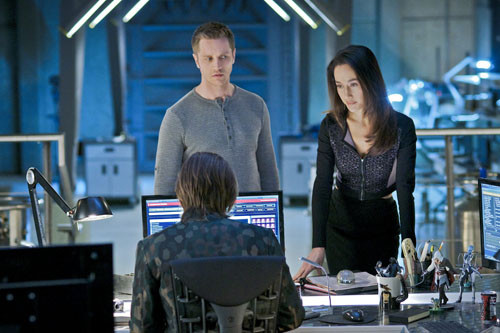
Where is `computer montior`? This screenshot has width=500, height=333. computer montior is located at coordinates (494, 232).